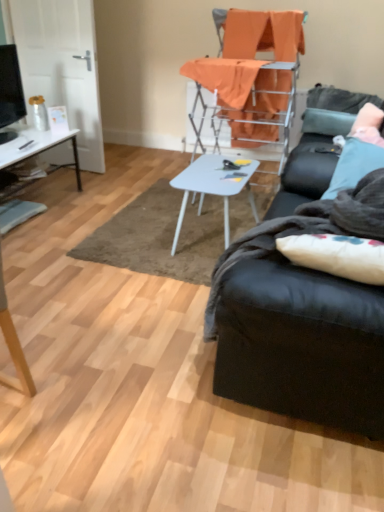
Question: Visually, is orange fabric chair at upper center positioned to the left or to the right of matte black tv at left?

Choices:
 (A) right
 (B) left

Answer: (A)

Question: From their relative heights in the image, would you say orange fabric chair at upper center is taller or shorter than matte black tv at left?

Choices:
 (A) tall
 (B) short

Answer: (A)

Question: Which object is positioned closest to the white glossy desk at left?

Choices:
 (A) dark gray plush blanket at right
 (B) matte black tv at left
 (C) white soft pillow at right
 (D) orange fabric chair at upper center
 (E) black leather couch at right

Answer: (B)

Question: Which object is the closest to the black leather couch at right?

Choices:
 (A) orange fabric chair at upper center
 (B) white glossy table at center
 (C) matte black tv at left
 (D) dark gray plush blanket at right
 (E) white glossy desk at left

Answer: (D)